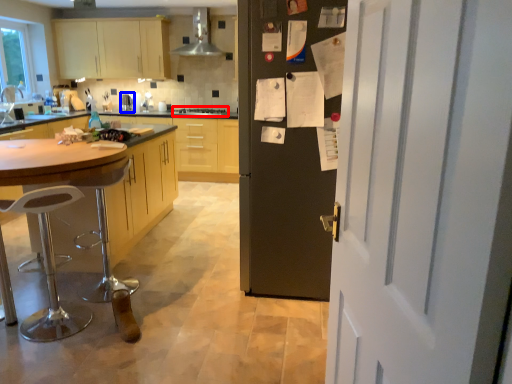
Question: Among these objects, which one is nearest to the camera, stove (highlighted by a red box) or appliance (highlighted by a blue box)?

Choices:
 (A) stove
 (B) appliance

Answer: (A)